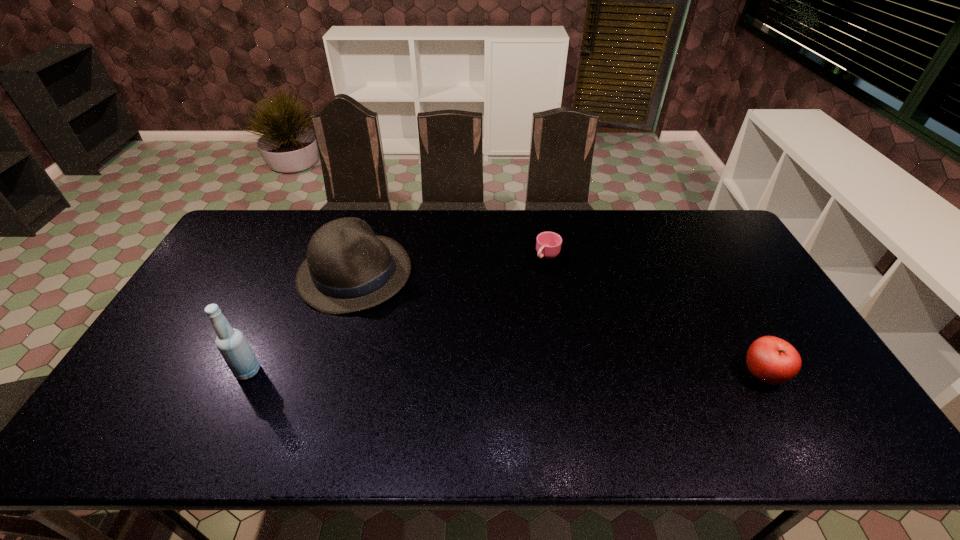
At what (x,y) coordinates should I click in order to perform the action: click on vacant area that lies between the shortest object and the second shortest object. Please return your answer as a coordinate pair (x, y). Image resolution: width=960 pixels, height=540 pixels. Looking at the image, I should click on (655, 315).

Image resolution: width=960 pixels, height=540 pixels. Identify the location of empty space that is in between the tallest object and the cup. (397, 314).

The height and width of the screenshot is (540, 960). I want to click on empty space between the bowler hat and the tallest object, so click(x=301, y=322).

Identify the location of free space that is in between the tallest object and the third tallest object. (505, 373).

In order to click on vacant space that is in between the cup and the rightmost object in this screenshot , I will do `click(655, 315)`.

Where is `object that stands as the third closest to the rightmost object`? The image size is (960, 540). object that stands as the third closest to the rightmost object is located at coordinates [234, 348].

The image size is (960, 540). I want to click on object identified as the third closest to the tallest object, so click(772, 360).

Where is `free space that satisfies the following two spatial constraints: 1. on the back side of the second object from right to left; 2. on the right side of the bowler hat`? This screenshot has width=960, height=540. free space that satisfies the following two spatial constraints: 1. on the back side of the second object from right to left; 2. on the right side of the bowler hat is located at coordinates (360, 256).

Where is `vacant region that satisfies the following two spatial constraints: 1. on the back side of the tallest object; 2. on the right side of the bowler hat`? vacant region that satisfies the following two spatial constraints: 1. on the back side of the tallest object; 2. on the right side of the bowler hat is located at coordinates (293, 274).